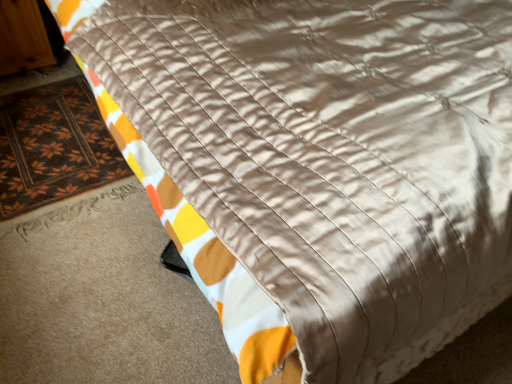
Question: From a real-world perspective, is wooden armoire at upper left physically located above or below brown woven mat at lower left?

Choices:
 (A) above
 (B) below

Answer: (A)

Question: Is wooden armoire at upper left taller or shorter than brown woven mat at lower left?

Choices:
 (A) short
 (B) tall

Answer: (B)

Question: Considering the positions of wooden armoire at upper left and brown woven mat at lower left in the image, is wooden armoire at upper left bigger or smaller than brown woven mat at lower left?

Choices:
 (A) big
 (B) small

Answer: (A)

Question: From their relative heights in the image, would you say brown woven mat at lower left is taller or shorter than wooden armoire at upper left?

Choices:
 (A) short
 (B) tall

Answer: (A)

Question: Does point (37, 160) appear closer or farther from the camera than point (27, 13)?

Choices:
 (A) closer
 (B) farther

Answer: (A)

Question: From the image's perspective, relative to wooden armoire at upper left, is brown woven mat at lower left above or below?

Choices:
 (A) above
 (B) below

Answer: (B)

Question: Looking at the image, does brown woven mat at lower left seem bigger or smaller compared to wooden armoire at upper left?

Choices:
 (A) big
 (B) small

Answer: (B)